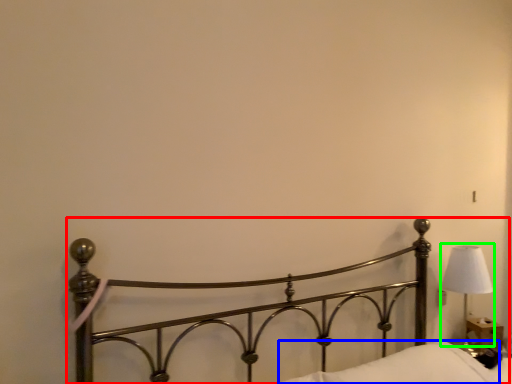
Question: Estimate the real-world distances between objects in this image. Which object is closer to bed (highlighted by a red box), pillow (highlighted by a blue box) or lamp (highlighted by a green box)?

Choices:
 (A) pillow
 (B) lamp

Answer: (A)